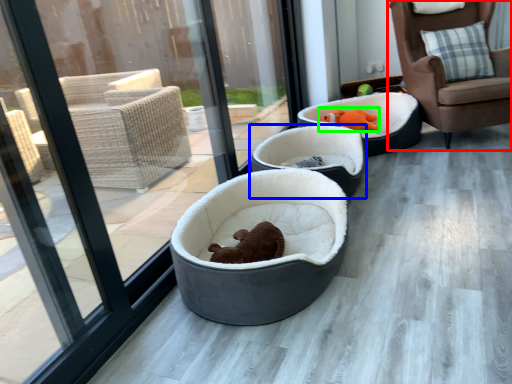
Question: Which object is the farthest from chair (highlighted by a red box)? Choose among these: dog bed (highlighted by a blue box) or animal (highlighted by a green box).

Choices:
 (A) dog bed
 (B) animal

Answer: (A)